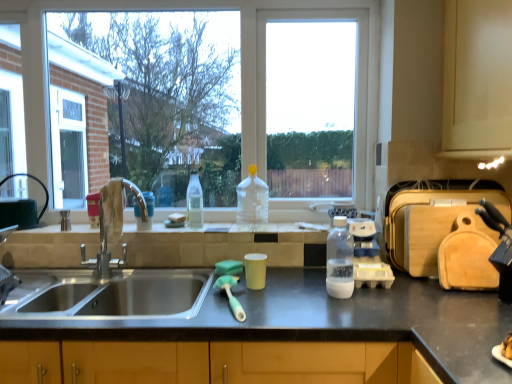
What do you see at coordinates (430, 218) in the screenshot? I see `wooden cutting board at right, which ranks as the first appliance in right-to-left order` at bounding box center [430, 218].

This screenshot has height=384, width=512. I want to click on translucent plastic bottle at center, which is the 1th appliance in left-to-right order, so click(x=368, y=256).

The width and height of the screenshot is (512, 384). I want to click on clear plastic bottle at center, marked as the 3th bottle in a front-to-back arrangement, so pos(194,201).

Where is `stainless steel sink at left`? The height and width of the screenshot is (384, 512). stainless steel sink at left is located at coordinates [x=105, y=283].

Locate an element on the screen. This screenshot has width=512, height=384. black granite countertop at center is located at coordinates (324, 320).

Based on the photo, from a real-world perspective, is black granite countertop at center physically located above or below clear plastic bottle at center, acting as the first bottle starting from the back?

black granite countertop at center is situated lower than clear plastic bottle at center, acting as the first bottle starting from the back, in the real world.

Are black granite countertop at center and clear plastic bottle at center, acting as the first bottle starting from the back, located far from each other?

black granite countertop at center is near clear plastic bottle at center, acting as the first bottle starting from the back, not far away.

Between point (303, 323) and point (193, 212), which one is positioned in front?

Positioned in front is point (303, 323).

Is transparent plastic bottle at center, the 3th bottle when ordered from back to front, at the back of translucent plastic bottle at center, the second appliance when ordered from right to left?

No, translucent plastic bottle at center, the second appliance when ordered from right to left,'s orientation is not away from transparent plastic bottle at center, the 3th bottle when ordered from back to front.

How many degrees apart are the facing directions of translucent plastic bottle at center, the second appliance when ordered from right to left, and transparent plastic bottle at center, the first bottle positioned from the right?

They differ by 92.6 degrees in their facing directions.

From a real-world perspective, is translucent plastic bottle at center, which is the 1th appliance in left-to-right order, physically located above or below transparent plastic bottle at center, which ranks as the third bottle in left-to-right order?

From a real-world perspective, translucent plastic bottle at center, which is the 1th appliance in left-to-right order, is physically below transparent plastic bottle at center, which ranks as the third bottle in left-to-right order.

Considering the sizes of translucent plastic bottle at center, the second appliance when ordered from right to left, and transparent plastic bottle at center, which ranks as the third bottle in left-to-right order, in the image, is translucent plastic bottle at center, the second appliance when ordered from right to left, taller or shorter than transparent plastic bottle at center, which ranks as the third bottle in left-to-right order,?

In the image, translucent plastic bottle at center, the second appliance when ordered from right to left, appears to be shorter than transparent plastic bottle at center, which ranks as the third bottle in left-to-right order.

Is translucent plastic bottle at center, the second appliance when ordered from right to left, closer to the viewer compared to wooden cutting board at right, which is the second appliance from left to right?

No, translucent plastic bottle at center, the second appliance when ordered from right to left, is further to the viewer.

From the image's perspective, between translucent plastic bottle at center, which is the 1th appliance in left-to-right order, and wooden cutting board at right, which is the second appliance from left to right, who is located below?

translucent plastic bottle at center, which is the 1th appliance in left-to-right order, is shown below in the image.

Considering the relative sizes of translucent plastic bottle at center, the second appliance when ordered from right to left, and wooden cutting board at right, which is the second appliance from left to right, in the image provided, is translucent plastic bottle at center, the second appliance when ordered from right to left, wider than wooden cutting board at right, which is the second appliance from left to right,?

No, translucent plastic bottle at center, the second appliance when ordered from right to left, is not wider than wooden cutting board at right, which is the second appliance from left to right.

Is black granite countertop at center next to transparent plastic bottle at center, which ranks as the third bottle in left-to-right order, and touching it?

black granite countertop at center and transparent plastic bottle at center, which ranks as the third bottle in left-to-right order, are clearly separated.

You are a GUI agent. You are given a task and a screenshot of the screen. Output one action in this format:
    pyautogui.click(x=<x>, y=<y>)
    Task: Click on the bottle that is the 3rd object to the right of the black granite countertop at center, starting at the anchor
    
    Given the screenshot: What is the action you would take?
    pyautogui.click(x=339, y=260)

Looking at this image, can we say black granite countertop at center lies outside transparent plastic bottle at center, which ranks as the third bottle in left-to-right order?

Yes, black granite countertop at center is outside of transparent plastic bottle at center, which ranks as the third bottle in left-to-right order.

Is black granite countertop at center positioned behind transparent plastic bottle at center, which ranks as the third bottle in left-to-right order?

That is False.

Which object is further away from the camera taking this photo, transparent plastic bottle at center, the 2th bottle when ordered from back to front, or black granite countertop at center?

transparent plastic bottle at center, the 2th bottle when ordered from back to front, is further from the camera.

From a real-world perspective, between transparent plastic bottle at center, which ranks as the second bottle in front-to-back order, and black granite countertop at center, who is vertically lower?

black granite countertop at center, from a real-world perspective.

Does transparent plastic bottle at center, positioned as the 2th bottle in right-to-left order, have a greater width compared to black granite countertop at center?

No.

From the image's perspective, is transparent plastic bottle at center, placed as the 2th bottle when sorted from left to right, located above black granite countertop at center?

Correct, transparent plastic bottle at center, placed as the 2th bottle when sorted from left to right, appears higher than black granite countertop at center in the image.

Is black granite countertop at center at the back of white plastic cup at sink?

white plastic cup at sink is not turned away from black granite countertop at center.

Which object is positioned more to the left, white plastic cup at sink or black granite countertop at center?

Positioned to the left is white plastic cup at sink.

Based on the photo, does white plastic cup at sink contain black granite countertop at center?

That's incorrect, black granite countertop at center is not inside white plastic cup at sink.

Find the location of `sink beneath the clear glass screen door at left (from a real-world perspective)`. sink beneath the clear glass screen door at left (from a real-world perspective) is located at coordinates (105, 283).

Is clear glass screen door at left wider or thinner than stainless steel sink at left?

Answer: In the image, clear glass screen door at left appears to be more narrow than stainless steel sink at left.

Who is bigger, clear glass screen door at left or stainless steel sink at left?

stainless steel sink at left is bigger.

Does point (64, 171) lie in front of point (127, 313)?

That is False.

The image size is (512, 384). Find the location of `the 2nd bottle above when counting from the black granite countertop at center (from the image's perspective)`. the 2nd bottle above when counting from the black granite countertop at center (from the image's perspective) is located at coordinates (194, 201).

From the transparent plastic bottle at center, the 3th bottle when ordered from back to front, count 2nd appliances backward and point to it. Please provide its 2D coordinates.

[(368, 256)]

Based on their spatial positions, is matte silver faucet at center or wooden cutting board at right, which is the second appliance from left to right, further from transparent plastic bottle at center, the 3th bottle when ordered from back to front?

Among the two, matte silver faucet at center is located further to transparent plastic bottle at center, the 3th bottle when ordered from back to front.

Looking at the image, which one is located further to black granite countertop at center, transparent plastic bottle at center, which is the 1th bottle from front to back, or clear plastic bottle at center, marked as the 3th bottle in a front-to-back arrangement?

The object further to black granite countertop at center is clear plastic bottle at center, marked as the 3th bottle in a front-to-back arrangement.

When comparing their distances from wooden cutting board at right, which is the second appliance from left to right, does black granite countertop at center or translucent plastic bottle at center, the second appliance when ordered from right to left, seem closer?

Based on the image, translucent plastic bottle at center, the second appliance when ordered from right to left, appears to be nearer to wooden cutting board at right, which is the second appliance from left to right.

When comparing their distances from transparent plastic bottle at center, which ranks as the second bottle in front-to-back order, does translucent plastic bottle at center, the second appliance when ordered from right to left, or clear plastic bottle at center, acting as the first bottle starting from the back, seem closer?

clear plastic bottle at center, acting as the first bottle starting from the back, lies closer to transparent plastic bottle at center, which ranks as the second bottle in front-to-back order, than the other object.

Considering their positions, is white plastic cup at sink positioned closer to black granite countertop at center than transparent plastic bottle at center, positioned as the 2th bottle in right-to-left order?

Based on the image, transparent plastic bottle at center, positioned as the 2th bottle in right-to-left order, appears to be nearer to black granite countertop at center.

Based on their spatial positions, is clear plastic bottle at center, acting as the first bottle starting from the back, or stainless steel sink at left closer to clear glass screen door at left?

The object closer to clear glass screen door at left is stainless steel sink at left.

Which object lies further to the anchor point wooden cutting board at right, which ranks as the first appliance in right-to-left order, stainless steel sink at left or white plastic cup at sink?

The object further to wooden cutting board at right, which ranks as the first appliance in right-to-left order, is white plastic cup at sink.

From the image, which object appears to be farther from wooden cutting board at right, which is the second appliance from left to right, transparent plastic bottle at center, the 3th bottle when ordered from back to front, or white plastic cup at sink?

white plastic cup at sink is further to wooden cutting board at right, which is the second appliance from left to right.

This screenshot has width=512, height=384. In order to click on bottle between transparent plastic bottle at center, which ranks as the second bottle in front-to-back order, and wooden cutting board at right, which ranks as the first appliance in right-to-left order, in the horizontal direction in this screenshot , I will do `click(339, 260)`.

What are the coordinates of `appliance between transparent plastic bottle at center, placed as the 2th bottle when sorted from left to right, and wooden cutting board at right, which is the second appliance from left to right, from left to right` in the screenshot? It's located at (368, 256).

The height and width of the screenshot is (384, 512). I want to click on food between matte silver faucet at center and clear glass screen door at left in the front-back direction, so click(x=177, y=218).

At what (x,y) coordinates should I click in order to perform the action: click on countertop between matte silver faucet at center and wooden cutting board at right, which ranks as the first appliance in right-to-left order. Please return your answer as a coordinate pair (x, y). Looking at the image, I should click on (324, 320).